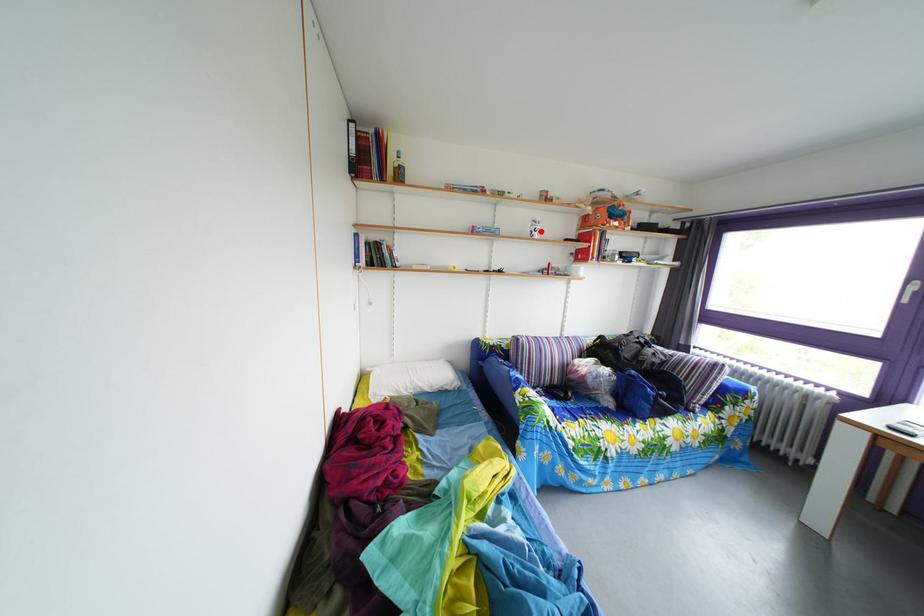
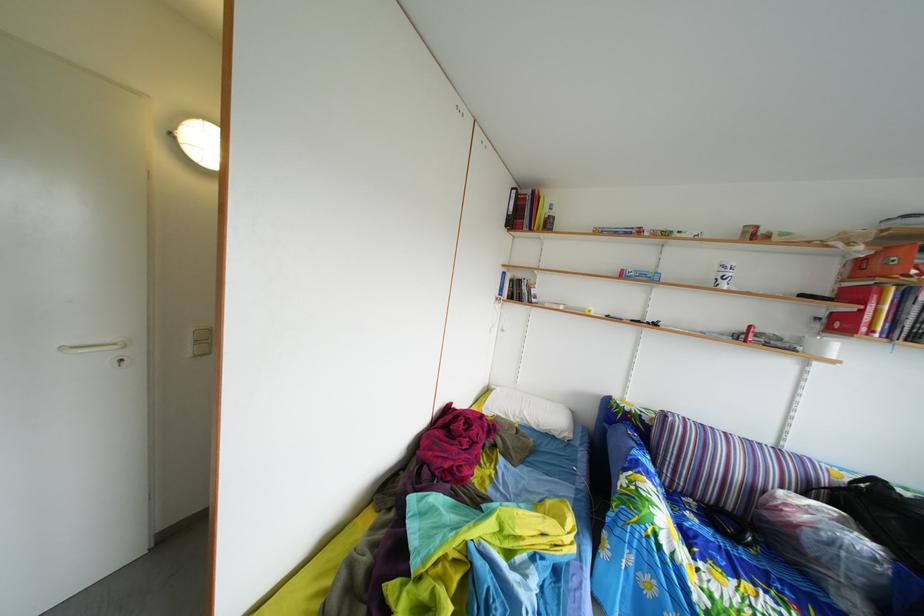
Where in the second image is the point corresponding to the highlighted location from the first image?

(727, 276)